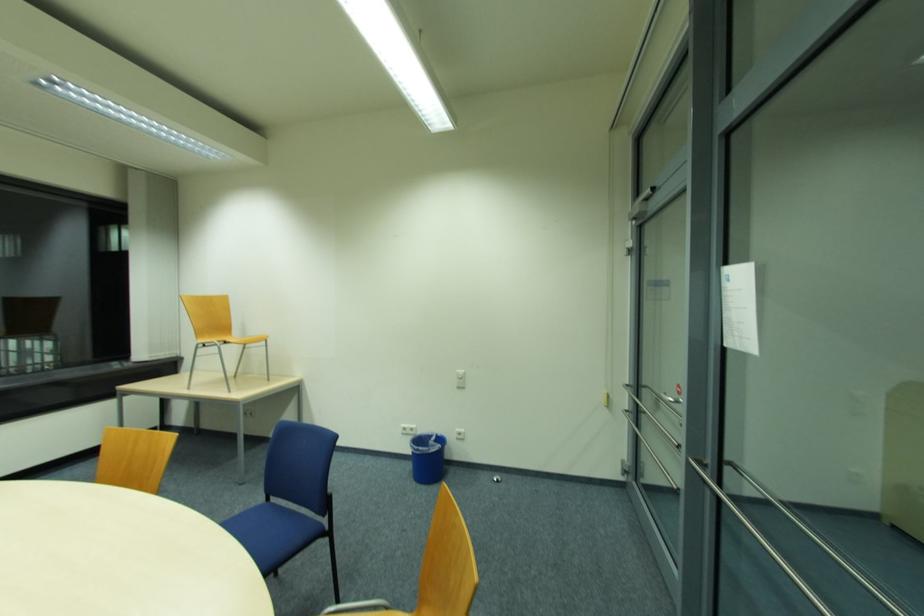
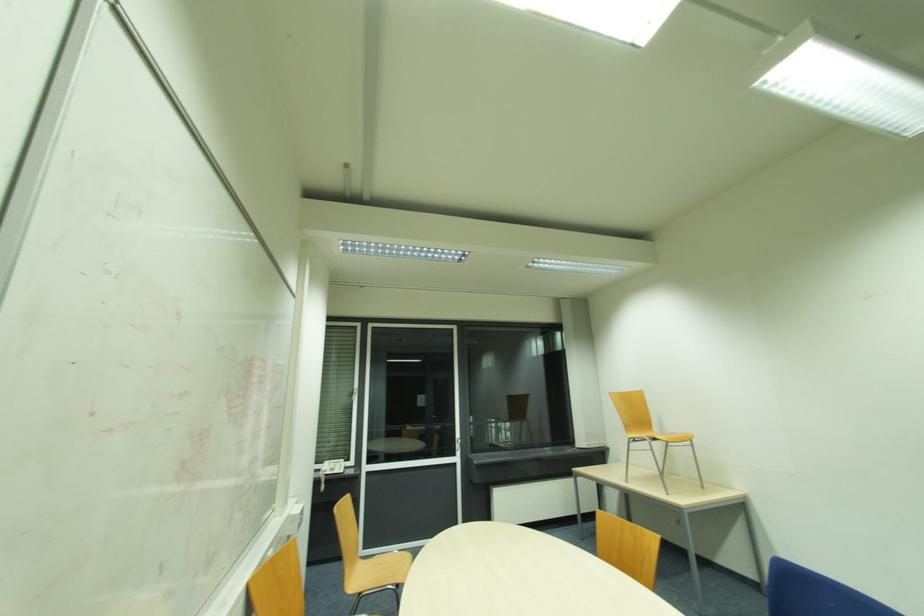
From the picture: Based on the continuous images, in which direction is the camera rotating?

The rotation direction of the camera is left-up.